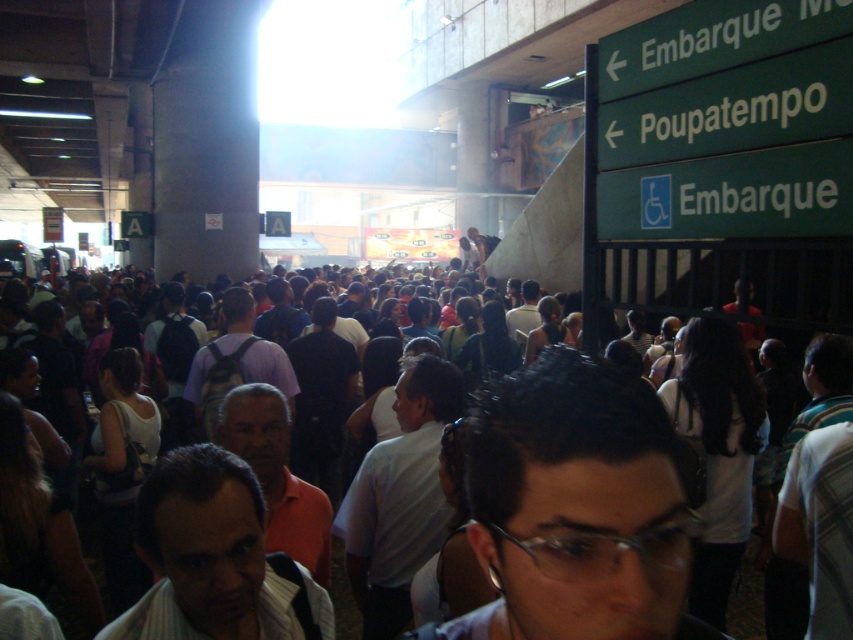
Question: Estimate the real-world distances between objects in this image. Which object is closer to the dark clothing crowd at center?

Choices:
 (A) orange matte shirt at center
 (B) dark hair at center
 (C) white matte shirt at center
 (D) dark purple shirt at center

Answer: (C)

Question: Which point is closer to the camera taking this photo?

Choices:
 (A) (312, 552)
 (B) (389, 474)

Answer: (A)

Question: Is white matte shirt at center above light brown leather jacket at center?

Choices:
 (A) no
 (B) yes

Answer: (A)

Question: Does striped shirt at center have a lesser width compared to white matte shirt at center?

Choices:
 (A) yes
 (B) no

Answer: (A)

Question: Can you confirm if dark hair at center is wider than orange matte shirt at center?

Choices:
 (A) yes
 (B) no

Answer: (A)

Question: Which point appears farthest from the camera in this image?

Choices:
 (A) (277, 484)
 (B) (251, 360)

Answer: (B)